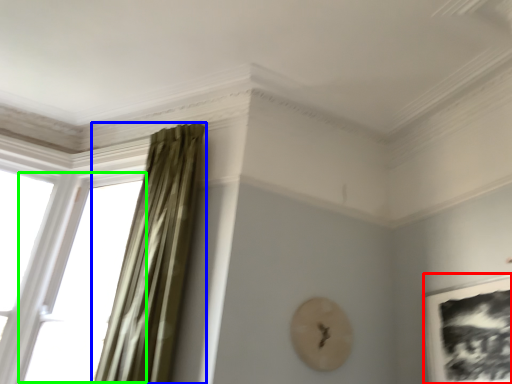
Question: Considering the real-world distances, which object is farthest from picture frame (highlighted by a red box)? curtain (highlighted by a blue box) or window (highlighted by a green box)?

Choices:
 (A) curtain
 (B) window

Answer: (B)